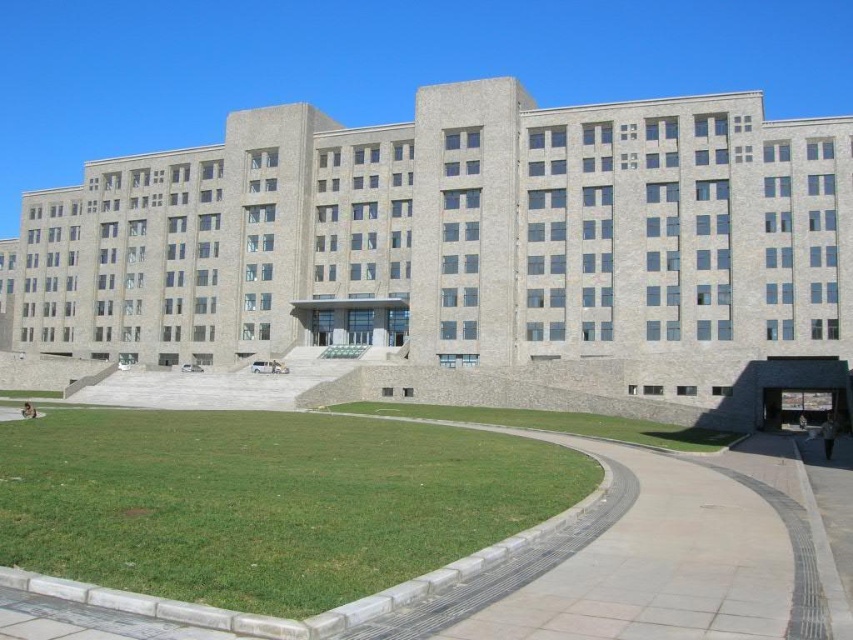
Which is more to the left, green grass at lower left or green grass at lower center?

From the viewer's perspective, green grass at lower left appears more on the left side.

Does green grass at lower left have a greater width compared to green grass at lower center?

In fact, green grass at lower left might be narrower than green grass at lower center.

Is point (463, 532) closer to camera compared to point (596, 433)?

Yes, point (463, 532) is closer to viewer.

At what (x,y) coordinates should I click in order to perform the action: click on green grass at lower left. Please return your answer as a coordinate pair (x, y). This screenshot has height=640, width=853. Looking at the image, I should click on (265, 500).